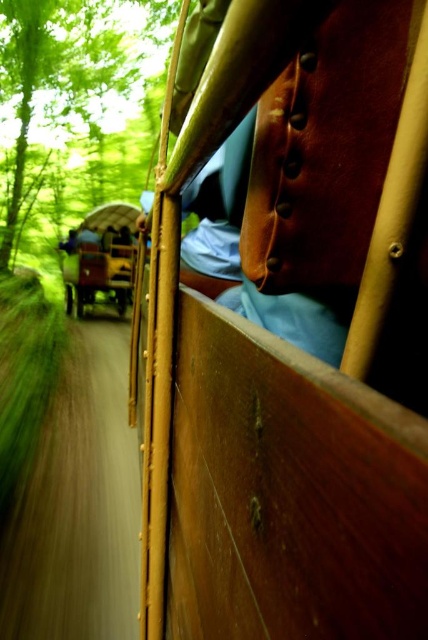
Question: Can you confirm if green leafy tree at upper left is thinner than wooden wagon at center?

Choices:
 (A) yes
 (B) no

Answer: (B)

Question: Among these objects, which one is farthest from the camera?

Choices:
 (A) green leafy tree at upper left
 (B) wooden wagon at center

Answer: (A)

Question: Is green leafy tree at upper left below wooden wagon at center?

Choices:
 (A) yes
 (B) no

Answer: (B)

Question: Can you confirm if green leafy tree at upper left is bigger than wooden wagon at center?

Choices:
 (A) yes
 (B) no

Answer: (A)